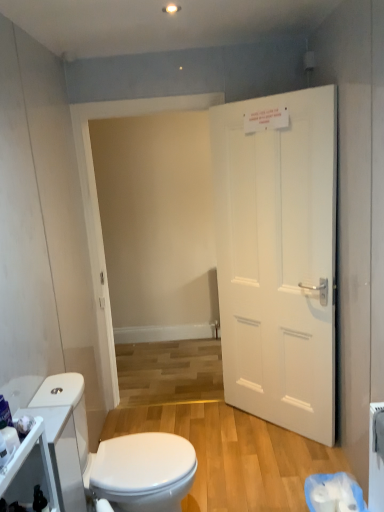
Question: From a real-world perspective, is white glossy cabinet at lower left located beneath white plastic toilet paper at lower right?

Choices:
 (A) yes
 (B) no

Answer: (B)

Question: Is white glossy cabinet at lower left surrounding white plastic toilet paper at lower right?

Choices:
 (A) yes
 (B) no

Answer: (B)

Question: Can you confirm if white glossy cabinet at lower left is thinner than white plastic toilet paper at lower right?

Choices:
 (A) no
 (B) yes

Answer: (B)

Question: Is white plastic toilet paper at lower right at the back of white glossy cabinet at lower left?

Choices:
 (A) yes
 (B) no

Answer: (B)

Question: Is white glossy cabinet at lower left smaller than white plastic toilet paper at lower right?

Choices:
 (A) no
 (B) yes

Answer: (A)

Question: Does white glossy cabinet at lower left turn towards white plastic toilet paper at lower right?

Choices:
 (A) no
 (B) yes

Answer: (B)

Question: Does white glossy toilet at lower left appear on the right side of white matte door at right?

Choices:
 (A) yes
 (B) no

Answer: (B)

Question: Considering the relative sizes of white glossy toilet at lower left and white matte door at right in the image provided, is white glossy toilet at lower left bigger than white matte door at right?

Choices:
 (A) no
 (B) yes

Answer: (A)

Question: Considering the relative positions of white glossy toilet at lower left and white matte door at right in the image provided, is white glossy toilet at lower left to the left of white matte door at right from the viewer's perspective?

Choices:
 (A) yes
 (B) no

Answer: (A)

Question: Is white glossy toilet at lower left facing away from white matte door at right?

Choices:
 (A) no
 (B) yes

Answer: (A)

Question: Is white glossy toilet at lower left aimed at white matte door at right?

Choices:
 (A) yes
 (B) no

Answer: (B)

Question: Is white glossy toilet at lower left smaller than white matte door at right?

Choices:
 (A) no
 (B) yes

Answer: (B)

Question: Is white glossy toilet at lower left to the left of white glossy cabinet at lower left from the viewer's perspective?

Choices:
 (A) yes
 (B) no

Answer: (B)